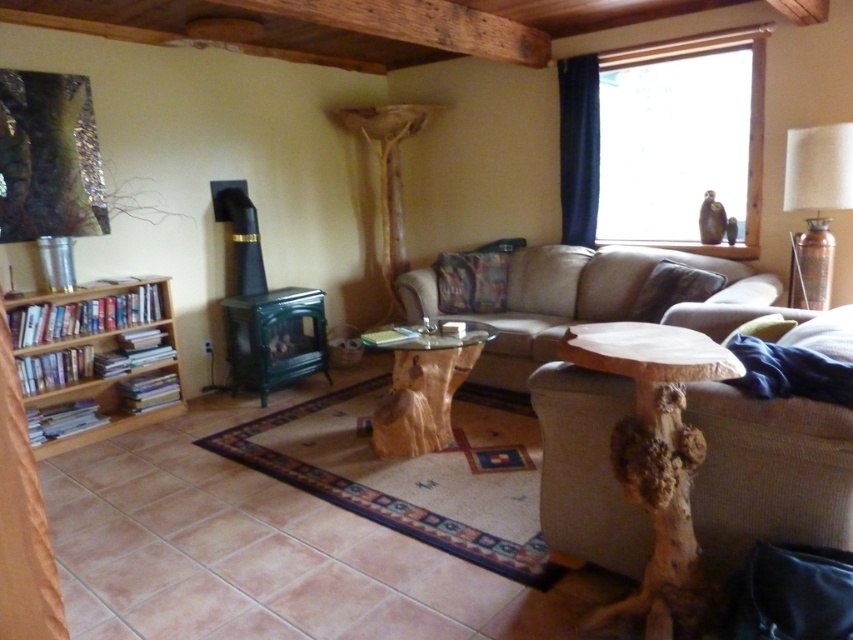
Question: Considering the real-world distances, which object is closest to the velvet green pillow at center?

Choices:
 (A) beige fabric couch at center
 (B) natural wood side table at lower right
 (C) natural wood table at center

Answer: (A)

Question: Which of the following is the farthest from the observer?

Choices:
 (A) natural wood side table at lower right
 (B) beige fabric couch at center
 (C) brown fuzzy pillow at upper right
 (D) velvet green pillow at center

Answer: (D)

Question: Can you confirm if natural wood side table at lower right is positioned above natural wood table at center?

Choices:
 (A) yes
 (B) no

Answer: (B)

Question: From the image, what is the correct spatial relationship of natural wood side table at lower right in relation to beige fabric couch at center?

Choices:
 (A) above
 (B) below

Answer: (B)

Question: Is natural wood table at center bigger than velvet green pillow at center?

Choices:
 (A) no
 (B) yes

Answer: (B)

Question: Which point is closer to the camera?

Choices:
 (A) light wood/bookshelf at left
 (B) brown fuzzy pillow at upper right
 (C) beige fabric couch at center
 (D) natural wood side table at lower right

Answer: (D)